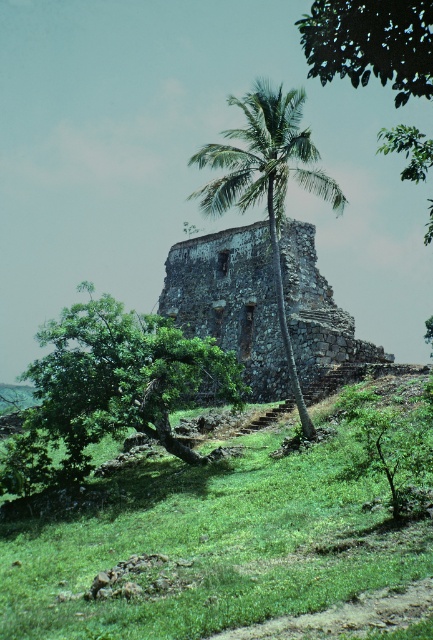
Based on the photo, you are standing at the base of the palm tree and want to take a photo of the ancient stone structure. You notice two points marked as point 1 at coordinates (x=112, y=621) and point 2 at coordinates (x=67, y=465) on the structure. Which point should you focus on first if you want to ensure both points are in sharp focus?

You should focus on point 1 at coordinates (x=112, y=621) first because it is closer to the camera than point 2 at coordinates (x=67, y=465). This will help ensure both points are in focus as the depth of field will extend from the focused point outward.

You are standing at the base of the hill looking up at the historical stone structure. You notice two green leafy trees in front of it. Which tree is closer to you, the green leafy tree at center or the green leafy palm at center?

The green leafy tree at center is closer to you because it is positioned under the green leafy palm at center, meaning the palm is further away.

You are standing at the base of the hill and looking up at the green grassy at center and the rusty stone ruins at center. Which one appears taller from your vantage point?

The rusty stone ruins at center are taller than the green grassy at center, so the rusty stone ruins at center appears taller from your vantage point.